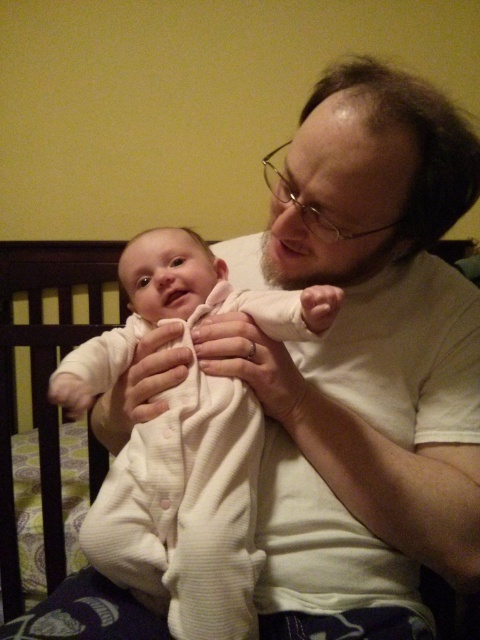
You are a parent trying to place your baby in the crib. The baby is wearing the white ribbed onesie at center, and you want to lay them on the white soft fabric at center. Considering the distance between them, will the baby fit comfortably on the fabric without needing to adjust their position?

The distance between the white ribbed onesie at center and the white soft fabric at center is 5.24 inches. Since the baby is already positioned close to the fabric, they can be comfortably placed on it without needing significant adjustment.

What is located at the point with coordinates (187, 509) in the image?

The white ribbed onesie at center is located at point (187, 509).